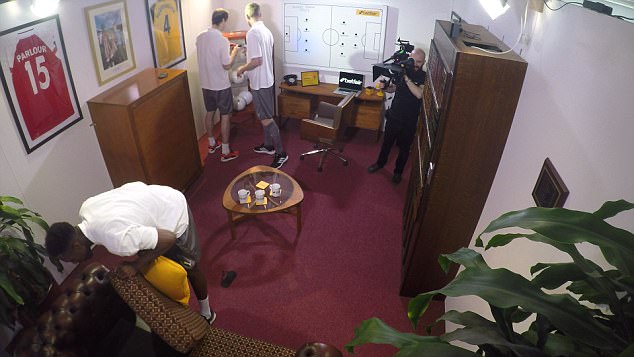
The image size is (634, 357). In order to click on carpet in this screenshot , I will do `click(323, 229)`.